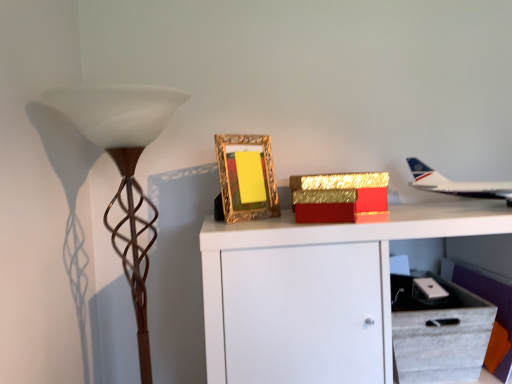
Question: Should I look upward or downward to see white fabric drawer at lower right?

Choices:
 (A) up
 (B) down

Answer: (B)

Question: Can you confirm if white glossy airplane at upper right is positioned to the right of white fabric drawer at lower right?

Choices:
 (A) no
 (B) yes

Answer: (B)

Question: Is white glossy airplane at upper right oriented away from white fabric drawer at lower right?

Choices:
 (A) no
 (B) yes

Answer: (A)

Question: Considering the relative sizes of white glossy airplane at upper right and white fabric drawer at lower right in the image provided, is white glossy airplane at upper right bigger than white fabric drawer at lower right?

Choices:
 (A) no
 (B) yes

Answer: (A)

Question: From a real-world perspective, is white glossy airplane at upper right located beneath white fabric drawer at lower right?

Choices:
 (A) yes
 (B) no

Answer: (B)

Question: Is white glossy airplane at upper right not near white fabric drawer at lower right?

Choices:
 (A) no
 (B) yes

Answer: (A)

Question: Is white glossy airplane at upper right in front of white fabric drawer at lower right?

Choices:
 (A) yes
 (B) no

Answer: (A)

Question: Are brown textured floor lamp at left and white fabric drawer at lower right beside each other?

Choices:
 (A) yes
 (B) no

Answer: (B)

Question: Does brown textured floor lamp at left have a lesser height compared to white fabric drawer at lower right?

Choices:
 (A) yes
 (B) no

Answer: (B)

Question: From a real-world perspective, does brown textured floor lamp at left stand above white fabric drawer at lower right?

Choices:
 (A) yes
 (B) no

Answer: (A)

Question: Can you confirm if brown textured floor lamp at left is smaller than white fabric drawer at lower right?

Choices:
 (A) no
 (B) yes

Answer: (A)

Question: Would you say brown textured floor lamp at left is a long distance from white fabric drawer at lower right?

Choices:
 (A) yes
 (B) no

Answer: (B)

Question: From the image's perspective, does brown textured floor lamp at left appear higher than white fabric drawer at lower right?

Choices:
 (A) yes
 (B) no

Answer: (A)

Question: Considering the relative positions of white glossy airplane at upper right and gold ornate frame at center in the image provided, is white glossy airplane at upper right behind gold ornate frame at center?

Choices:
 (A) yes
 (B) no

Answer: (B)